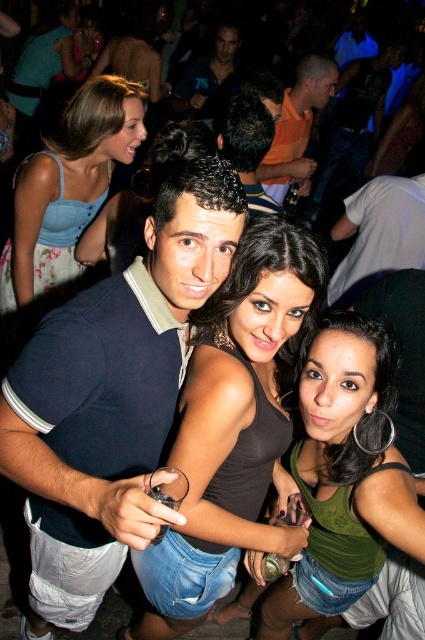
Question: Is dark blue polo shirt at center above white cotton shirt at upper right?

Choices:
 (A) yes
 (B) no

Answer: (B)

Question: Does dark blue polo shirt at center appear on the right side of dark brown hair at center?

Choices:
 (A) yes
 (B) no

Answer: (B)

Question: Which of these objects is positioned closest to the orange cotton shirt at center?

Choices:
 (A) denim dress at upper left
 (B) dark brown hair at center

Answer: (B)

Question: Which object is closer to the camera taking this photo?

Choices:
 (A) denim dress at upper left
 (B) green matte tank top at center
 (C) dark blue polo shirt at center
 (D) orange cotton shirt at center

Answer: (C)

Question: Which of the following is the farthest from the observer?

Choices:
 (A) matte black tank top at center
 (B) green matte tank top at center

Answer: (B)

Question: Is dark blue polo shirt at center to the left of denim dress at upper left from the viewer's perspective?

Choices:
 (A) yes
 (B) no

Answer: (B)